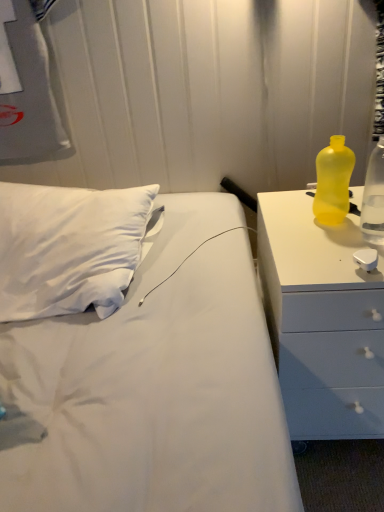
Question: Does yellow translucent bottle at right, positioned as the 2th bottle in right-to-left order, come in front of yellow translucent bottle at right, the 2th bottle viewed from the left?

Choices:
 (A) yes
 (B) no

Answer: (B)

Question: Can you confirm if yellow translucent bottle at right, which ranks as the first bottle in left-to-right order, is shorter than yellow translucent bottle at right, the first bottle positioned from the right?

Choices:
 (A) no
 (B) yes

Answer: (B)

Question: Is yellow translucent bottle at right, positioned as the 2th bottle in right-to-left order, not close to yellow translucent bottle at right, the first bottle positioned from the right?

Choices:
 (A) no
 (B) yes

Answer: (A)

Question: Is yellow translucent bottle at right, which ranks as the first bottle in left-to-right order, oriented towards yellow translucent bottle at right, the 2th bottle viewed from the left?

Choices:
 (A) yes
 (B) no

Answer: (B)

Question: Is yellow translucent bottle at right, which ranks as the first bottle in left-to-right order, smaller than yellow translucent bottle at right, the 2th bottle viewed from the left?

Choices:
 (A) yes
 (B) no

Answer: (B)

Question: Is yellow translucent bottle at right, positioned as the 2th bottle in right-to-left order, not inside yellow translucent bottle at right, the first bottle positioned from the right?

Choices:
 (A) yes
 (B) no

Answer: (A)

Question: From a real-world perspective, is yellow translucent bottle at right, the first bottle positioned from the right, located higher than yellow translucent bottle at right, positioned as the 2th bottle in right-to-left order?

Choices:
 (A) yes
 (B) no

Answer: (A)

Question: Considering the relative sizes of yellow translucent bottle at right, the 2th bottle viewed from the left, and yellow translucent bottle at right, which ranks as the first bottle in left-to-right order, in the image provided, is yellow translucent bottle at right, the 2th bottle viewed from the left, smaller than yellow translucent bottle at right, which ranks as the first bottle in left-to-right order,?

Choices:
 (A) yes
 (B) no

Answer: (A)

Question: Does yellow translucent bottle at right, the first bottle positioned from the right, come in front of yellow translucent bottle at right, which ranks as the first bottle in left-to-right order?

Choices:
 (A) yes
 (B) no

Answer: (A)

Question: Considering the relative sizes of yellow translucent bottle at right, the 2th bottle viewed from the left, and yellow translucent bottle at right, which ranks as the first bottle in left-to-right order, in the image provided, is yellow translucent bottle at right, the 2th bottle viewed from the left, taller than yellow translucent bottle at right, which ranks as the first bottle in left-to-right order,?

Choices:
 (A) yes
 (B) no

Answer: (A)

Question: From the image's perspective, is yellow translucent bottle at right, the 2th bottle viewed from the left, beneath yellow translucent bottle at right, which ranks as the first bottle in left-to-right order?

Choices:
 (A) no
 (B) yes

Answer: (B)

Question: Is yellow translucent bottle at right, the first bottle positioned from the right, to the left of yellow translucent bottle at right, positioned as the 2th bottle in right-to-left order, from the viewer's perspective?

Choices:
 (A) yes
 (B) no

Answer: (B)

Question: From a real-world perspective, is yellow plastic bottle at right over yellow translucent bottle at right, the 2th bottle viewed from the left?

Choices:
 (A) no
 (B) yes

Answer: (A)